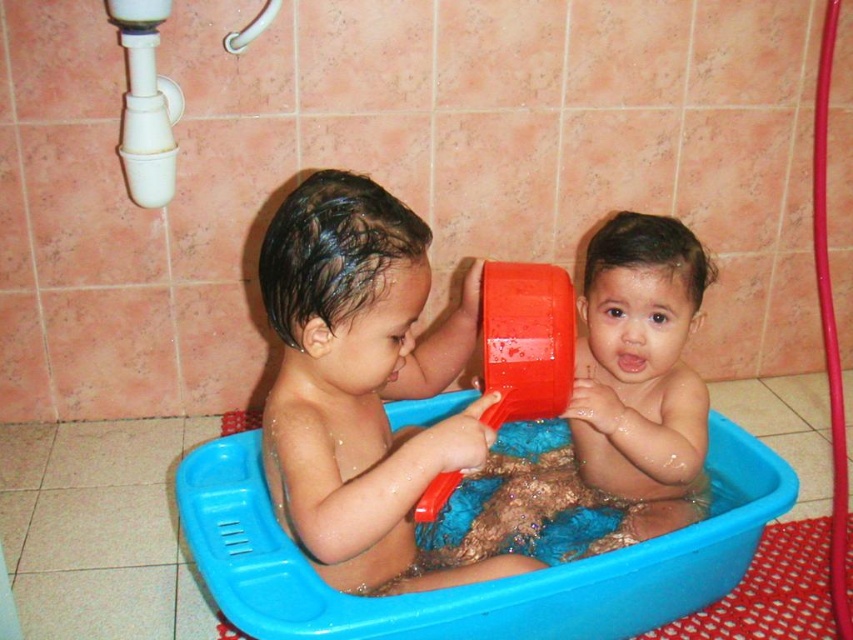
Who is positioned more to the right, matte plastic boy at center or matte plastic baby at center?

Positioned to the right is matte plastic baby at center.

Between matte plastic boy at center and matte plastic baby at center, which one has more height?

Standing taller between the two is matte plastic boy at center.

Does point (286, 504) come behind point (698, 483)?

No, it is not.

In order to click on matte plastic boy at center in this screenshot , I will do `click(363, 385)`.

Is matte plastic boy at center positioned in front of white plastic shower at upper left?

Yes, matte plastic boy at center is in front of white plastic shower at upper left.

Find the location of a particular element. The image size is (853, 640). matte plastic boy at center is located at coordinates (363, 385).

Image resolution: width=853 pixels, height=640 pixels. Find the location of `matte plastic boy at center`. matte plastic boy at center is located at coordinates (363, 385).

This screenshot has width=853, height=640. Describe the element at coordinates (480, 582) in the screenshot. I see `blue plastic tub at center` at that location.

Which is behind, point (257, 627) or point (132, 36)?

The point (132, 36) is more distant.

This screenshot has height=640, width=853. I want to click on blue plastic tub at center, so click(480, 582).